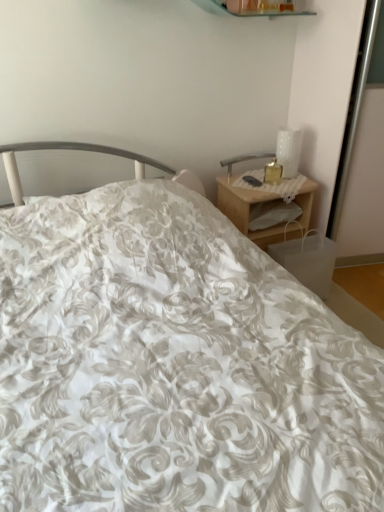
Question: Which is correct: woodennightstand at right is inside translucent glass candle at upper right, or outside of it?

Choices:
 (A) outside
 (B) inside

Answer: (A)

Question: From the image's perspective, relative to translucent glass candle at upper right, is woodennightstand at right above or below?

Choices:
 (A) below
 (B) above

Answer: (A)

Question: Estimate the real-world distances between objects in this image. Which object is farther from the translucent glass candle at upper right?

Choices:
 (A) woodennightstand at right
 (B) white glossy table lamp at upper right

Answer: (A)

Question: Which is nearer to the white glossy table lamp at upper right?

Choices:
 (A) translucent glass candle at upper right
 (B) woodennightstand at right

Answer: (A)